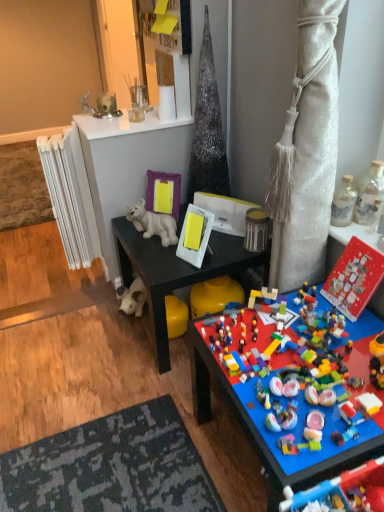
At what (x,y) coordinates should I click in order to perform the action: click on vacant region to the left of white plastic picture frame at center, which appears as the first picture frame when viewed from the front. Please return your answer as a coordinate pair (x, y). This screenshot has width=384, height=512. Looking at the image, I should click on (160, 258).